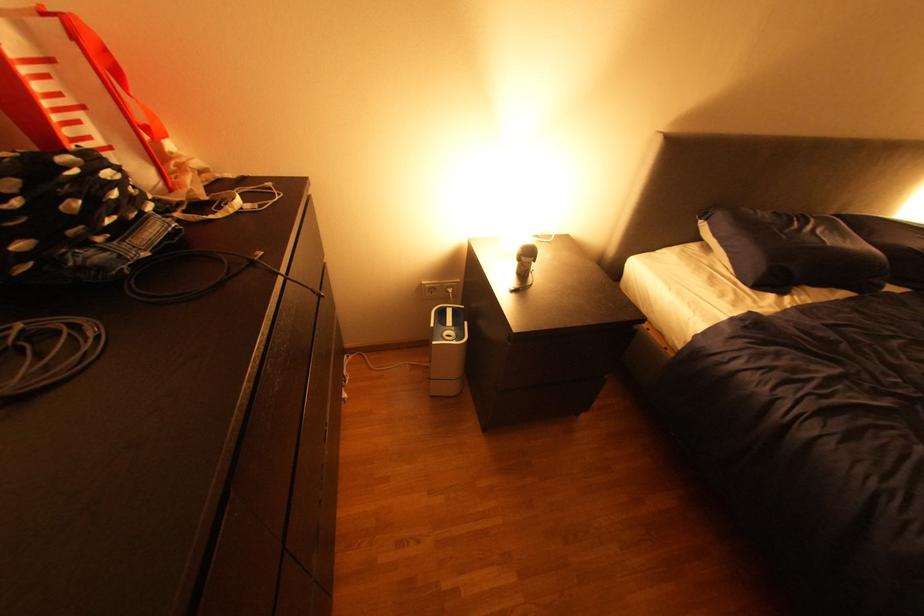
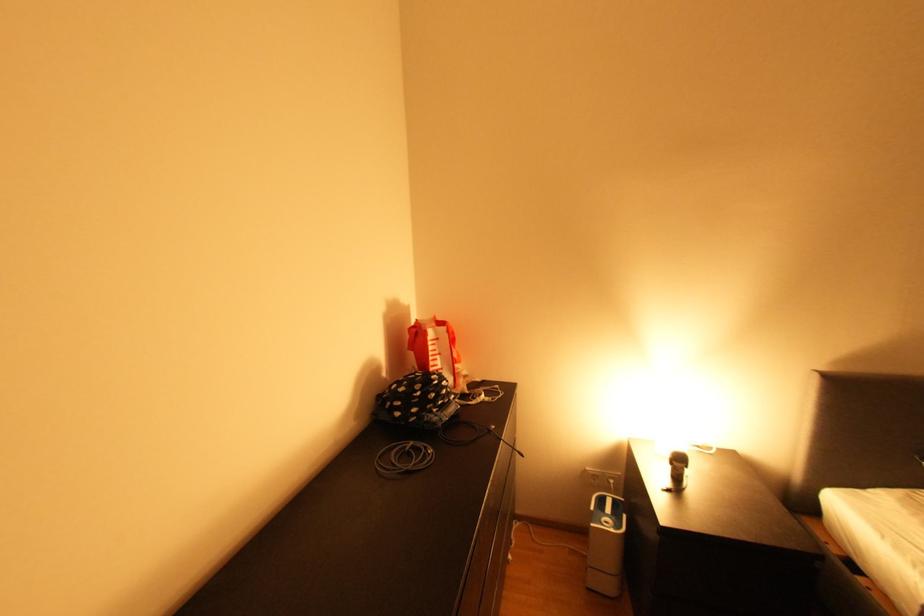
In the second image, find the point that corresponds to (x=141, y=190) in the first image.

(457, 389)